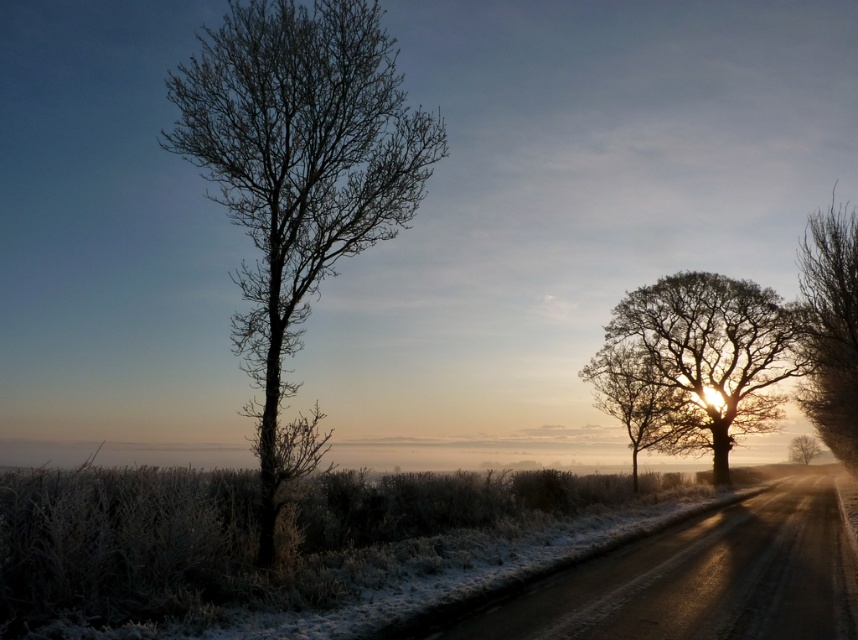
Question: Which point is farther from the camera taking this photo?

Choices:
 (A) (760, 316)
 (B) (384, 202)

Answer: (A)

Question: Observing the image, what is the correct spatial positioning of bare branches at left in reference to silhouetted bark tree at right?

Choices:
 (A) below
 (B) above

Answer: (B)

Question: Among these points, which one is farthest from the camera?

Choices:
 (A) tap(662, 323)
 (B) tap(635, 456)

Answer: (A)

Question: Among these points, which one is farthest from the camera?

Choices:
 (A) (429, 166)
 (B) (724, 310)
 (C) (835, 288)

Answer: (B)

Question: Can you confirm if bare branches at left is smaller than silvery frosty tree at right?

Choices:
 (A) no
 (B) yes

Answer: (A)

Question: Is silhouetted bark tree at right closer to the viewer compared to silvery bark tree at right?

Choices:
 (A) no
 (B) yes

Answer: (A)